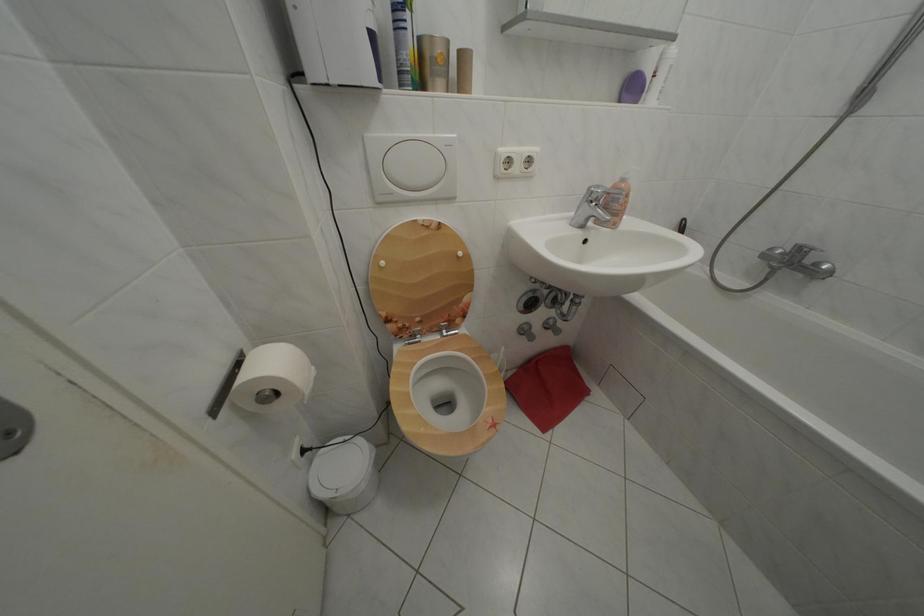
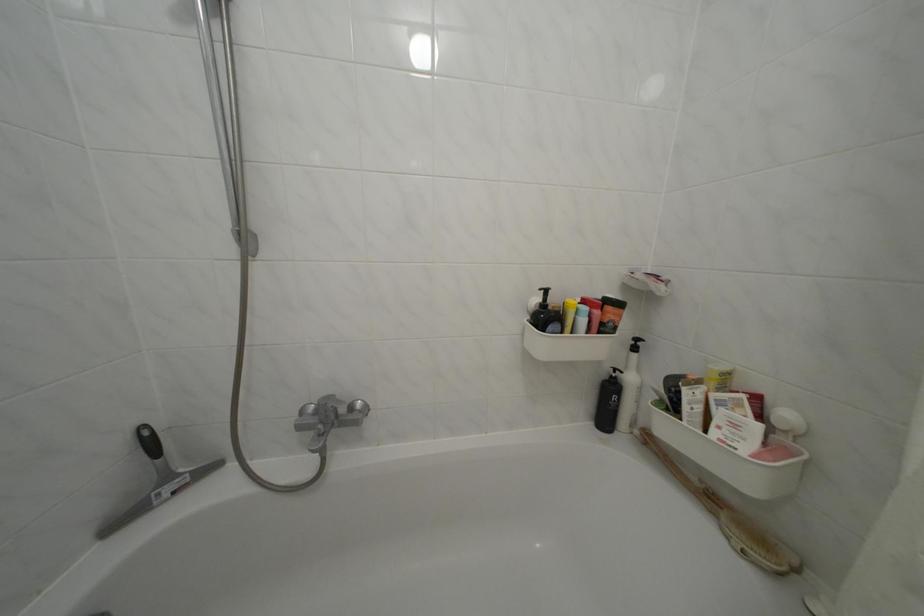
Question: The camera is either moving clockwise (left) or counter-clockwise (right) around the object. The first image is from the beginning of the video and the second image is from the end. Is the camera moving left or right when shooting the video?

Choices:
 (A) Left
 (B) Right

Answer: (A)